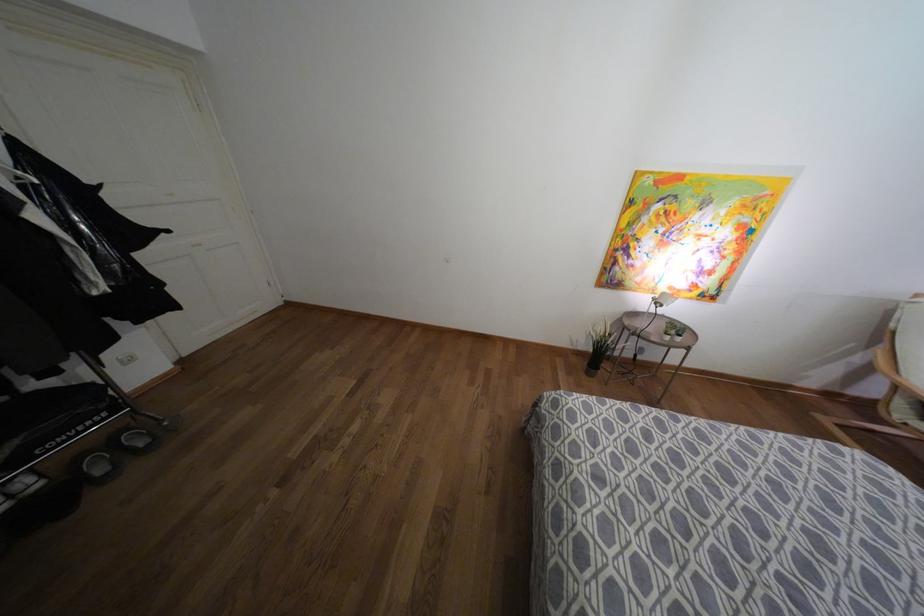
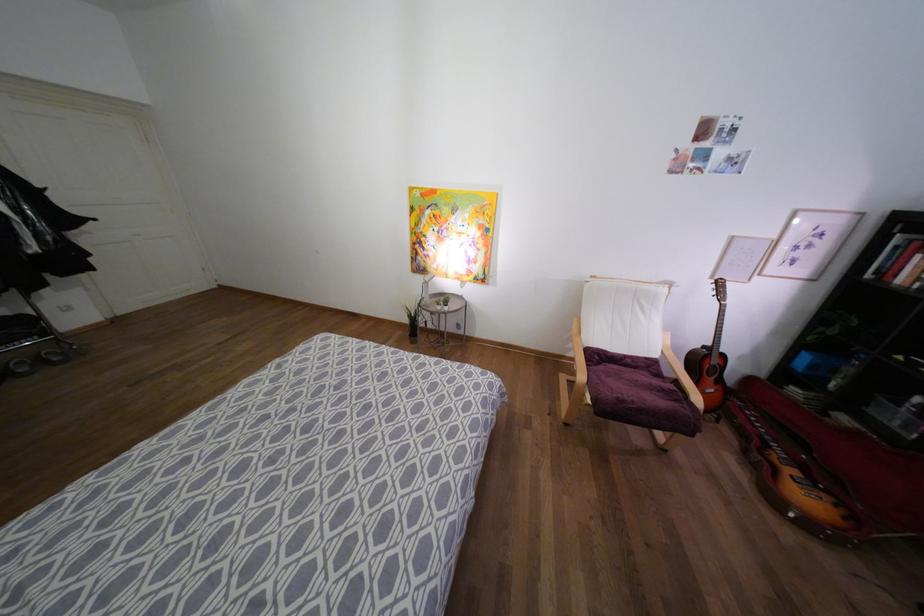
Question: The images are taken continuously from a first-person perspective. In which direction are you moving?

Choices:
 (A) Left
 (B) Right
 (C) Forward
 (D) Backward

Answer: (B)